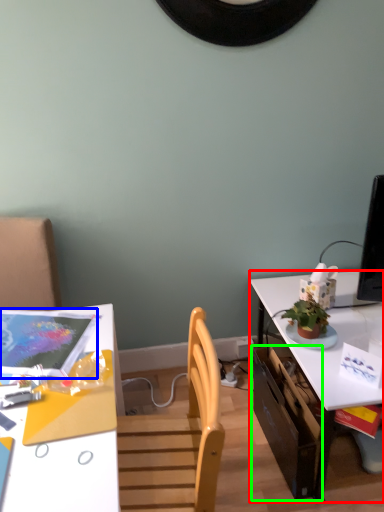
Question: Based on their relative distances, which object is nearer to table (highlighted by a red box)? Choose from magazine (highlighted by a blue box) and drawer (highlighted by a green box).

Choices:
 (A) magazine
 (B) drawer

Answer: (B)